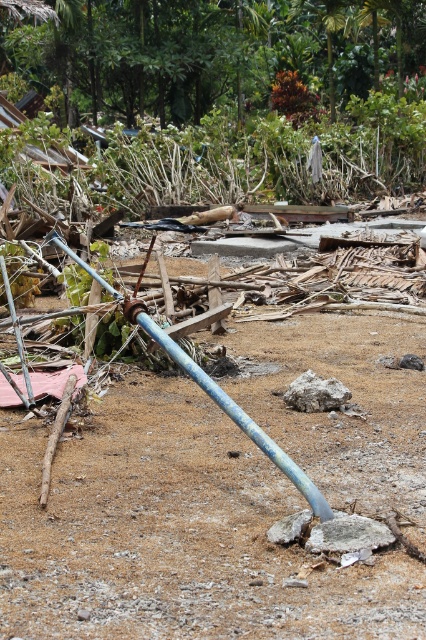
You are a construction worker assessing the site. You see the brown sandy dirt at center and the blue painted metal water pipe at center. Which object is closer to you?

The brown sandy dirt at center is closer to you because it is in front of the blue painted metal water pipe at center.

You are a construction worker inspecting the site. You need to lift the blue painted metal water pipe at center to check for damage. Will you first need to remove the brown sandy dirt at center from its current position?

Yes, the brown sandy dirt at center is positioned under the blue painted metal water pipe at center, so you must remove the dirt before lifting the pipe.

You are a construction worker who needs to place a 28 inch long tool between the brown sandy dirt at center and the blue painted metal water pipe at center. Can you fit the tool between them without bending it?

The distance between the brown sandy dirt at center and the blue painted metal water pipe at center is 30.11 inches, so the 28 inch tool can fit between them without bending since it is shorter than the available space.